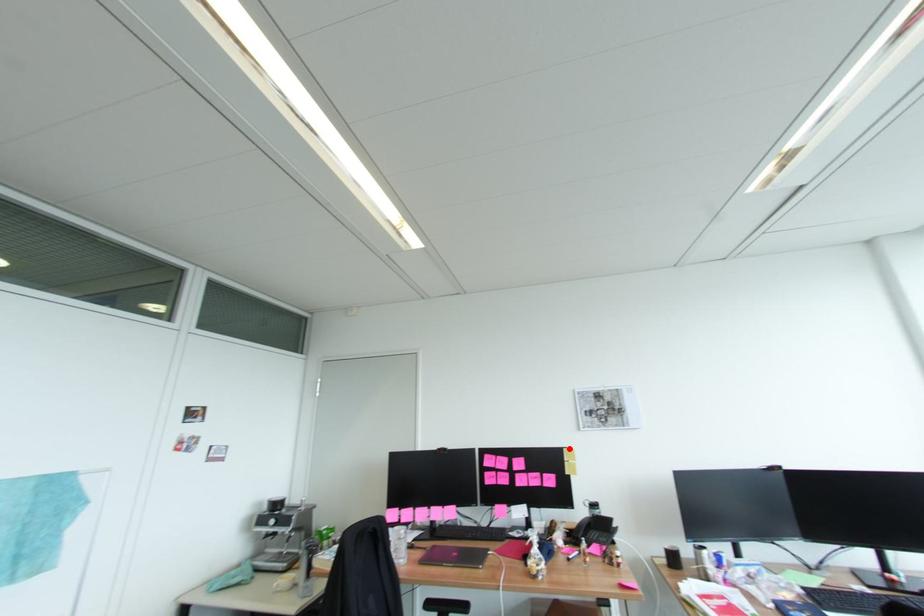
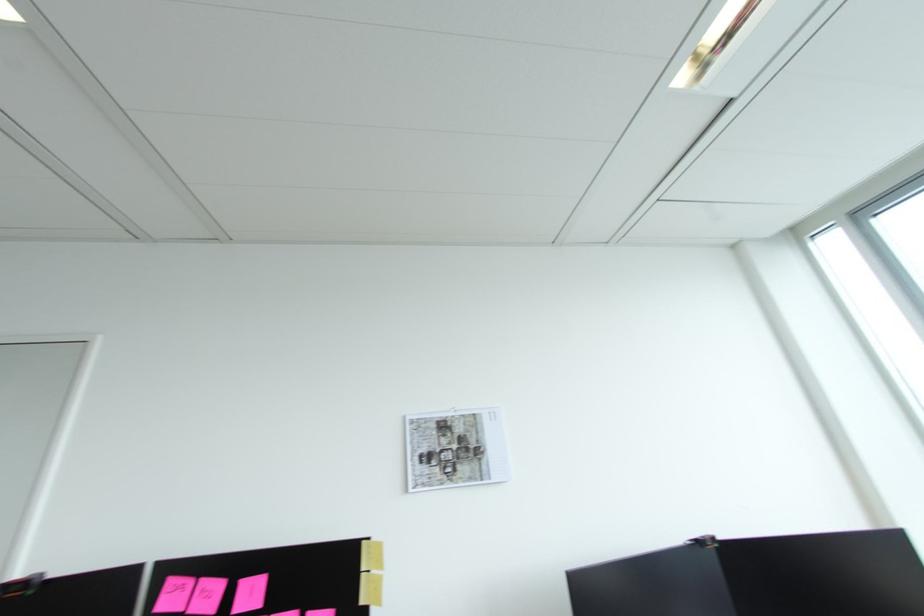
The point at the highlighted location is marked in the first image. Where is the corresponding point in the second image?

(368, 541)